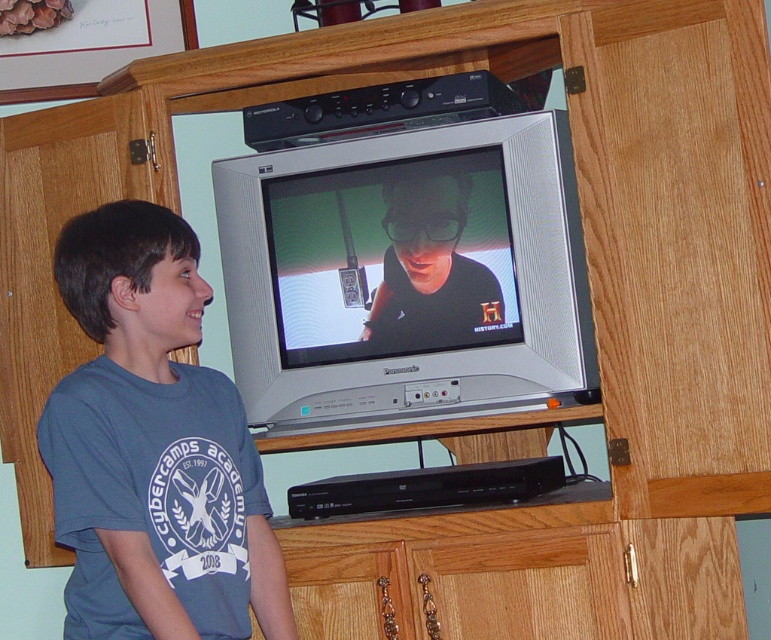
You are a delivery person who needs to place a new TV stand that is 2 meters wide. The current setup has the silver metallic television at center and the blue cotton shirt at center. Can the new TV stand fit between them without moving any existing items?

The silver metallic television at center has a smaller size compared to blue cotton shirt at center. However, the description does not provide information about the distance between them, so it is impossible to determine if the TV stand can fit.

From the picture: The boy wants to touch the silver metallic television at center and the blue cotton shirt at center. Which one is closer to his hand?

The blue cotton shirt at center is closer to the boy because it is only 38.40 centimeters away from the silver metallic television at center, but since the shirt is on him, it is right at his hand.